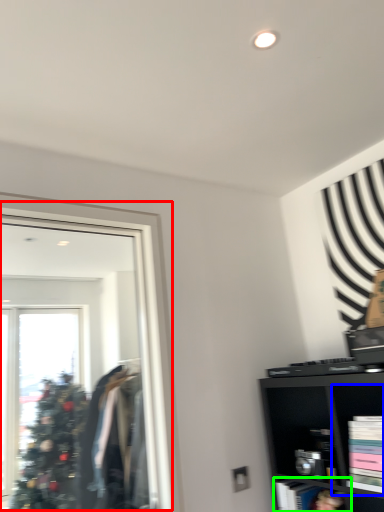
Question: Which is nearer to the mirror (highlighted by a red box)? cabinet (highlighted by a blue box) or cabinet (highlighted by a green box).

Choices:
 (A) cabinet
 (B) cabinet

Answer: (B)